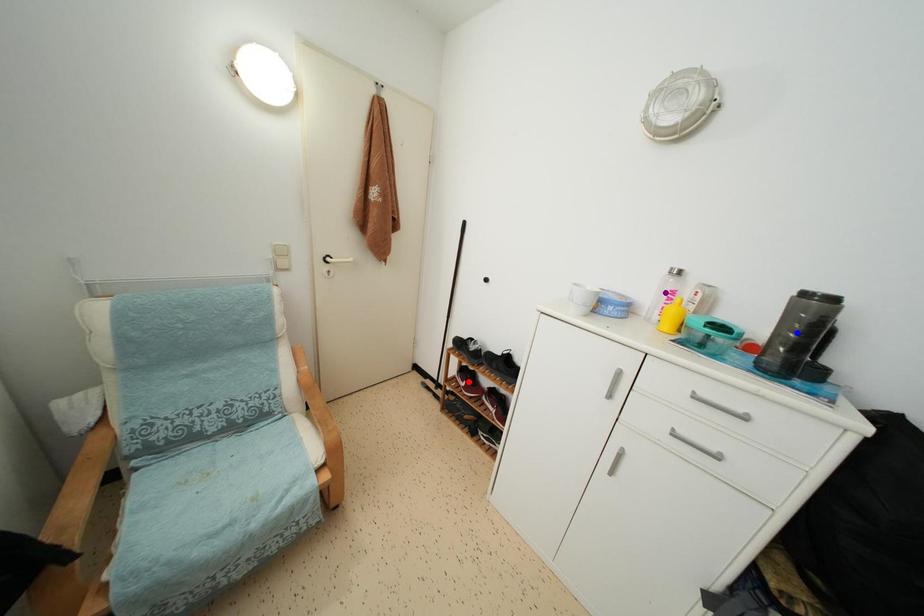
Order these from farthest to nearest:
- purple point
- red point
- blue point

red point → purple point → blue point